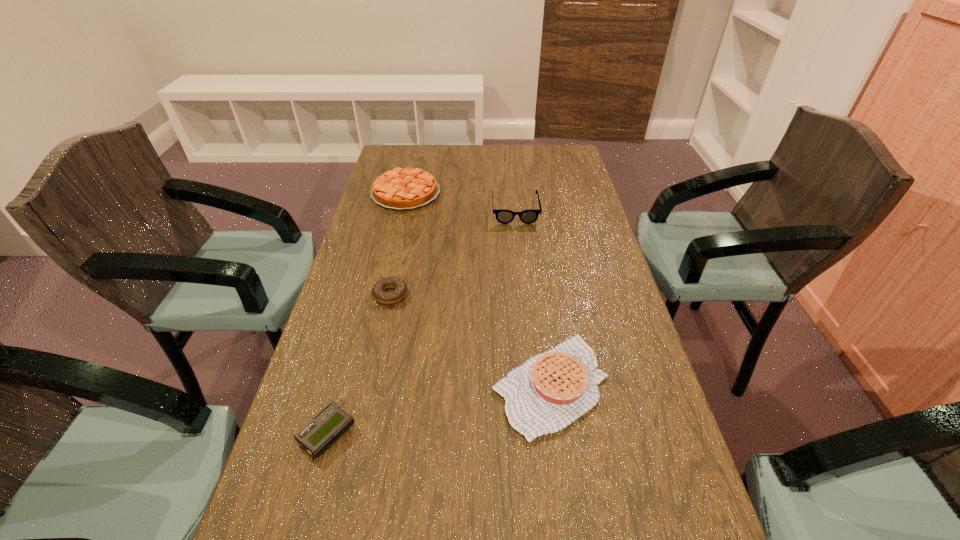
Find the location of a particular element. Image resolution: width=960 pixels, height=540 pixels. pie that is positioned at the left edge is located at coordinates (407, 188).

Image resolution: width=960 pixels, height=540 pixels. I want to click on doughnut positioned at the left edge, so click(x=378, y=291).

Image resolution: width=960 pixels, height=540 pixels. In order to click on beeper located at the left edge in this screenshot , I will do `click(325, 427)`.

You are a GUI agent. You are given a task and a screenshot of the screen. Output one action in this format:
    pyautogui.click(x=<x>, y=<y>)
    Task: Click on the object present at the right edge
    This screenshot has height=540, width=960.
    Given the screenshot: What is the action you would take?
    pyautogui.click(x=548, y=392)

Locate an element on the screen. This screenshot has height=540, width=960. vacant space at the far edge of the desktop is located at coordinates (482, 158).

I want to click on free space at the left edge of the desktop, so [385, 319].

Locate an element on the screen. free point at the right edge is located at coordinates (567, 287).

Locate an element on the screen. The width and height of the screenshot is (960, 540). vacant area at the far right corner is located at coordinates (x=575, y=162).

Identify the location of blank region between the nearer pie and the spectacles. The width and height of the screenshot is (960, 540). (533, 298).

Image resolution: width=960 pixels, height=540 pixels. In order to click on vacant region between the tallest object and the beeper in this screenshot , I will do `click(420, 321)`.